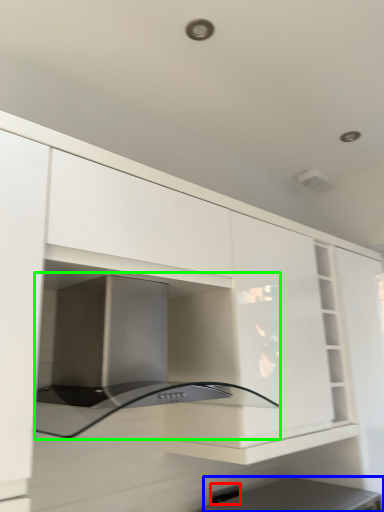
Question: Which is nearer to the electric outlet (highlighted by a red box)? appliance (highlighted by a blue box) or oven (highlighted by a green box).

Choices:
 (A) appliance
 (B) oven

Answer: (A)